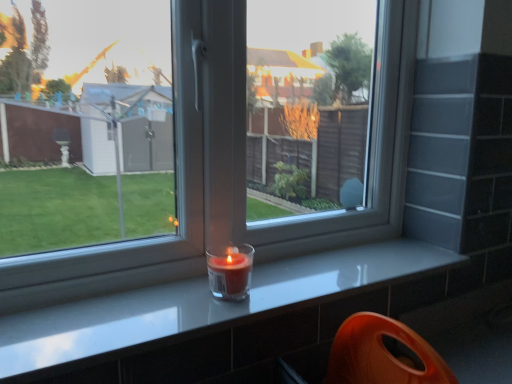
Image resolution: width=512 pixels, height=384 pixels. I want to click on vacant space in front of translucent glass candle at window, so click(x=199, y=319).